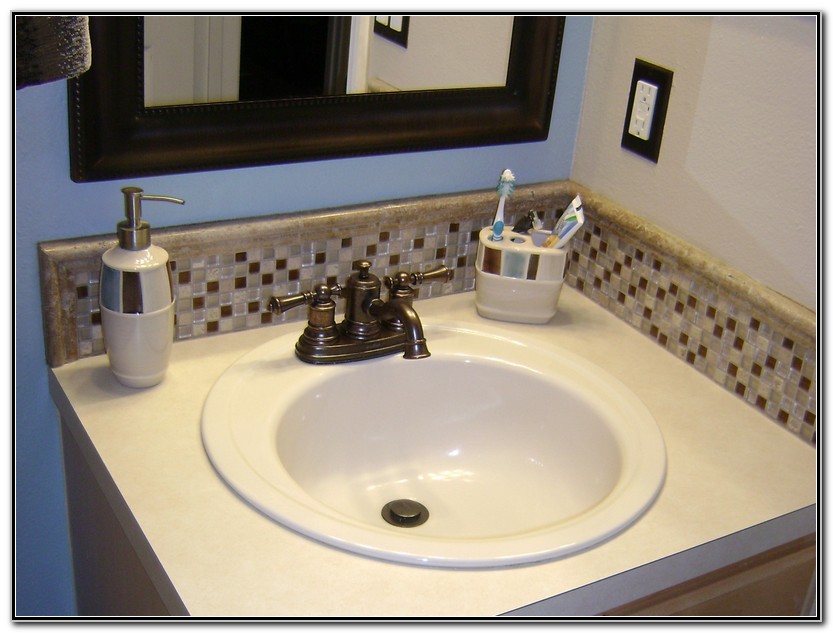
Image resolution: width=833 pixels, height=633 pixels. What are the coordinates of `blue wall background` in the screenshot? It's located at (557, 99).